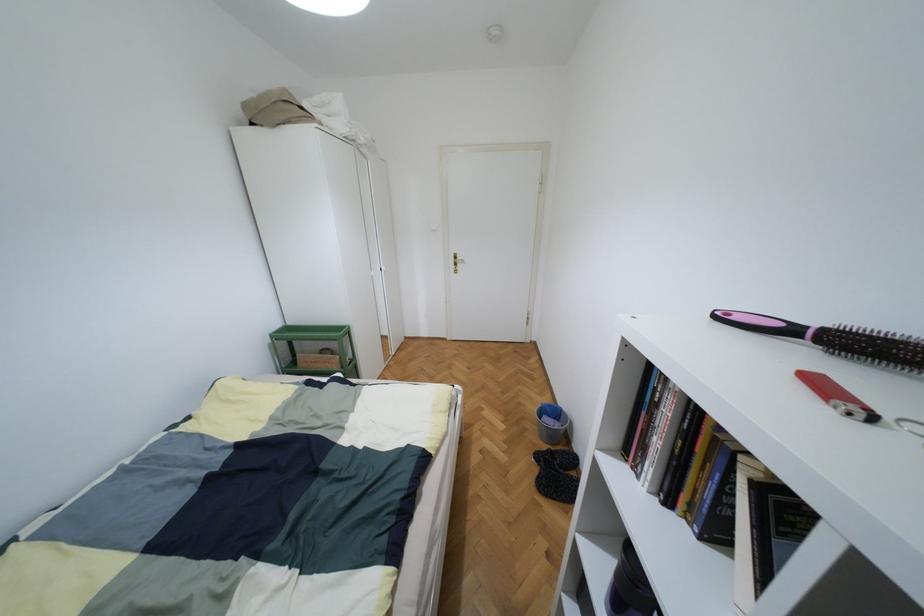
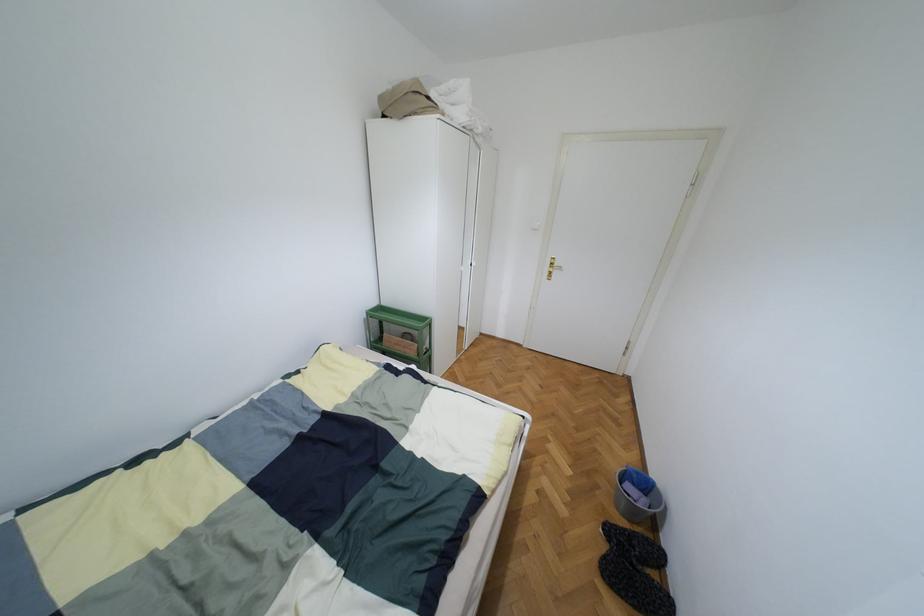
The point at (549, 406) is marked in the first image. Where is the corresponding point in the second image?

(638, 472)